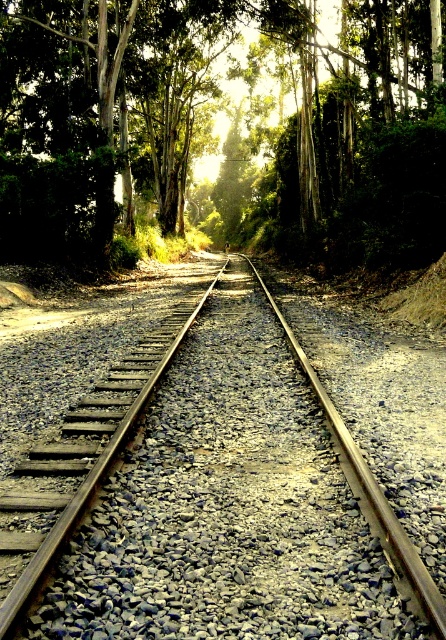
You are a landscape photographer planning to capture the scene with the metal train track at center and the green leafy tree at center. Which object appears taller in the photo?

The green leafy tree at center is taller than the metal train track at center.

You are a railway inspector checking the track alignment. You notice the metal train track at center and the green leafy tree at center. Which one has a smaller width?

The metal train track at center has a smaller width than the green leafy tree at center.